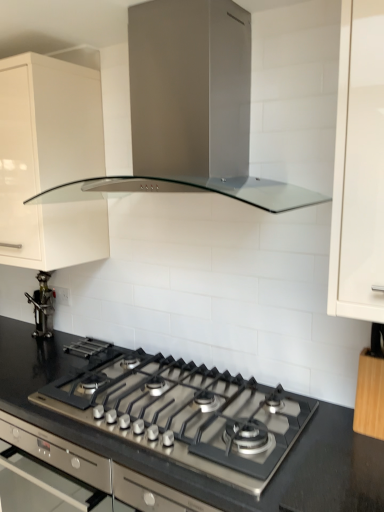
Question: Is black granite countertop at center to the right of white glossy cabinet at upper left, the first cabinetry from the left, from the viewer's perspective?

Choices:
 (A) yes
 (B) no

Answer: (A)

Question: Is black granite countertop at center wider than white glossy cabinet at upper left, the first cabinetry from the left?

Choices:
 (A) no
 (B) yes

Answer: (B)

Question: Is black granite countertop at center facing away from white glossy cabinet at upper left, which appears as the first cabinetry when viewed from the back?

Choices:
 (A) yes
 (B) no

Answer: (B)

Question: From a real-world perspective, is black granite countertop at center physically above white glossy cabinet at upper left, which is counted as the 2th cabinetry, starting from the bottom?

Choices:
 (A) yes
 (B) no

Answer: (B)

Question: Is white glossy cabinet at upper left, the first cabinetry from the left, completely or partially inside black granite countertop at center?

Choices:
 (A) no
 (B) yes

Answer: (A)

Question: In the image, is black granite countertop at center on the left side or the right side of satin silver range hood at upper center?

Choices:
 (A) right
 (B) left

Answer: (B)

Question: Considering the positions of point (192, 504) and point (225, 183), is point (192, 504) closer or farther from the camera than point (225, 183)?

Choices:
 (A) farther
 (B) closer

Answer: (B)

Question: Considering their positions, is black granite countertop at center located in front of or behind satin silver range hood at upper center?

Choices:
 (A) front
 (B) behind

Answer: (B)

Question: Is black granite countertop at center inside or outside of satin silver range hood at upper center?

Choices:
 (A) outside
 (B) inside

Answer: (A)

Question: Is wooden knife block at right, which appears as the second cabinetry when viewed from the left, spatially inside metallic figurine at left, or outside of it?

Choices:
 (A) inside
 (B) outside

Answer: (B)

Question: Considering the positions of wooden knife block at right, the 1th cabinetry positioned from the right, and metallic figurine at left in the image, is wooden knife block at right, the 1th cabinetry positioned from the right, taller or shorter than metallic figurine at left?

Choices:
 (A) tall
 (B) short

Answer: (A)

Question: From a real-world perspective, is wooden knife block at right, marked as the first cabinetry in a front-to-back arrangement, above or below metallic figurine at left?

Choices:
 (A) below
 (B) above

Answer: (B)

Question: Would you say wooden knife block at right, the 1th cabinetry when ordered from bottom to top, is to the left or to the right of metallic figurine at left in the picture?

Choices:
 (A) left
 (B) right

Answer: (B)

Question: From the image's perspective, is white glossy cabinet at upper left, which is the second cabinetry from front to back, positioned above or below wooden knife block at right, the 1th cabinetry positioned from the right?

Choices:
 (A) below
 (B) above

Answer: (B)

Question: Is white glossy cabinet at upper left, which is counted as the 2th cabinetry, starting from the bottom, inside or outside of wooden knife block at right, the 1th cabinetry when ordered from bottom to top?

Choices:
 (A) outside
 (B) inside

Answer: (A)